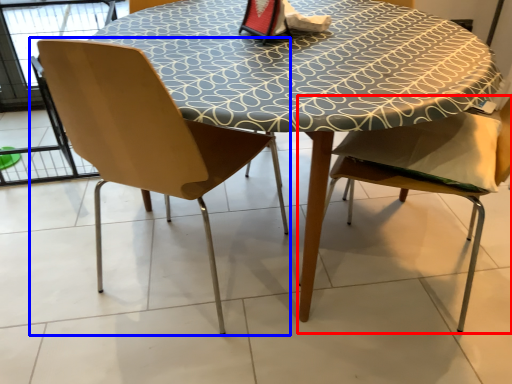
Question: Which object appears farthest to the camera in this image, chair (highlighted by a red box) or chair (highlighted by a blue box)?

Choices:
 (A) chair
 (B) chair

Answer: (B)